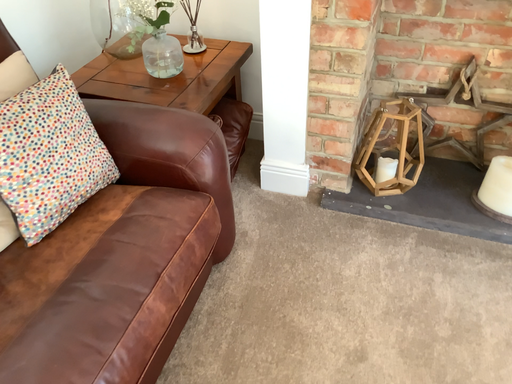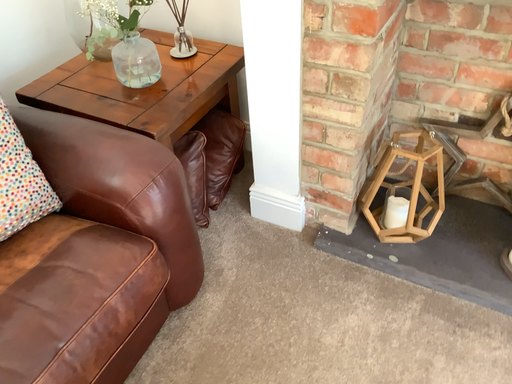
Question: Which way did the camera rotate in the video?

Choices:
 (A) rotated left
 (B) rotated right

Answer: (A)